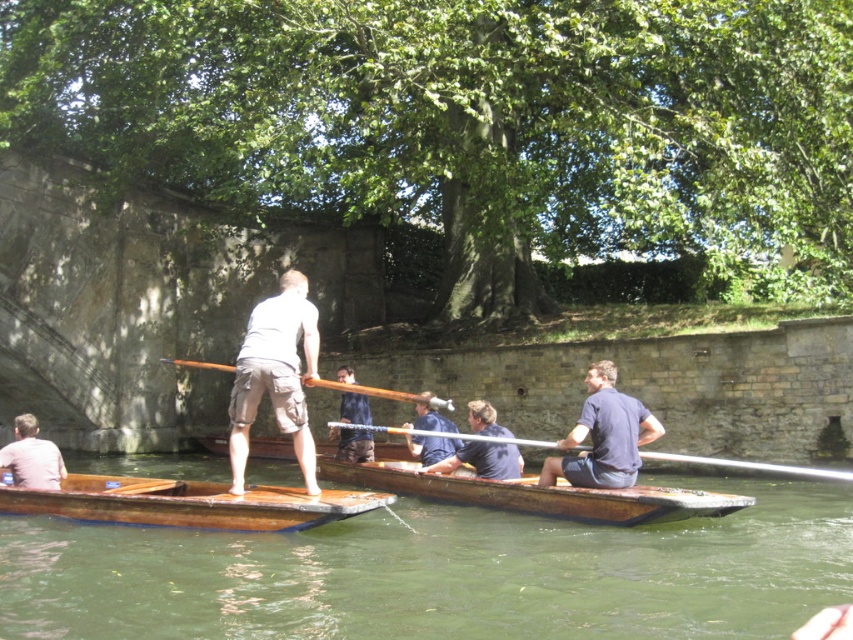
Question: Is dark blue fabric shirt at center wider than wooden at center?

Choices:
 (A) no
 (B) yes

Answer: (A)

Question: Among these objects, which one is nearest to the camera?

Choices:
 (A) wooden polished paddle at center
 (B) dark blue fabric shirt at center
 (C) light brown leather jacket at lower left
 (D) wooden canoe at center

Answer: (D)

Question: Which of these objects is positioned closest to the wooden canoe at center?

Choices:
 (A) light brown leather jacket at lower left
 (B) dark blue shirt at center
 (C) khaki cargo shorts at center

Answer: (B)

Question: Among these points, which one is nearest to the camera?

Choices:
 (A) (312, 477)
 (B) (357, 458)

Answer: (A)

Question: Does wooden at center have a larger size compared to wooden polished paddle at center?

Choices:
 (A) yes
 (B) no

Answer: (A)

Question: Can you confirm if wooden boat at center is bigger than light brown leather jacket at lower left?

Choices:
 (A) yes
 (B) no

Answer: (B)